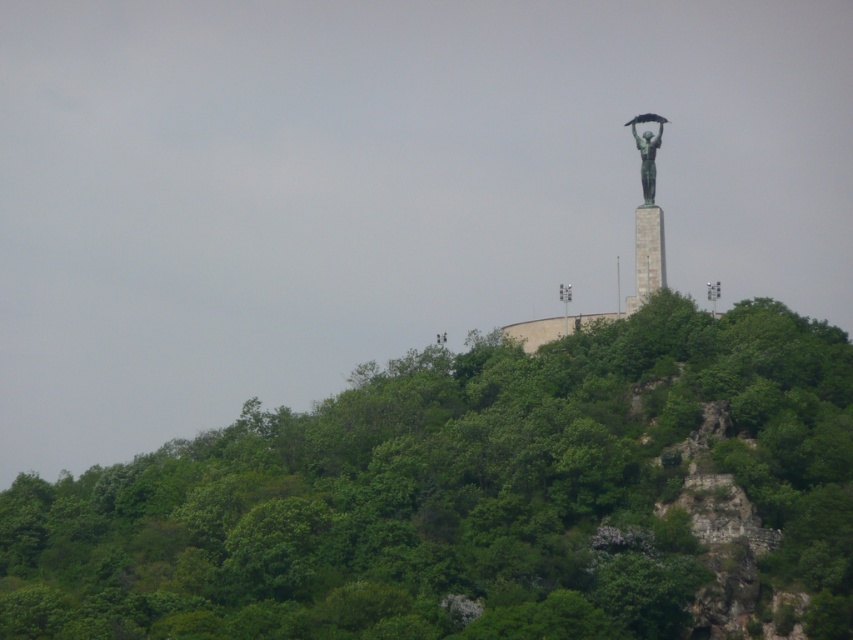
Can you confirm if smooth gray tower at upper center is smaller than bronze statue at upper center?

No, smooth gray tower at upper center is not smaller than bronze statue at upper center.

Is smooth gray tower at upper center thinner than bronze statue at upper center?

Incorrect, smooth gray tower at upper center's width is not less than bronze statue at upper center's.

What do you see at coordinates (647, 253) in the screenshot? I see `smooth gray tower at upper center` at bounding box center [647, 253].

In order to click on smooth gray tower at upper center in this screenshot , I will do `click(647, 253)`.

Can you confirm if bronze statue at upper center is wider than gray metallic lamp post at upper center?

No.

What do you see at coordinates (647, 152) in the screenshot? I see `bronze statue at upper center` at bounding box center [647, 152].

Is point (648, 170) closer to camera compared to point (711, 300)?

No, it is not.

Find the location of a particular element. bronze statue at upper center is located at coordinates (647, 152).

Who is lower down, green patina statue at upper center or bronze statue at upper center?

green patina statue at upper center is below.

Between point (634, 234) and point (650, 198), which one is positioned behind?

Point (634, 234)

Where is `green patina statue at upper center`? green patina statue at upper center is located at coordinates (647, 216).